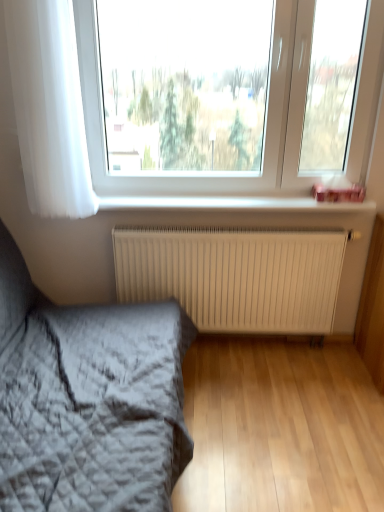
Question: Considering the relative sizes of white matte radiator at center and white plastic window sill at upper center in the image provided, is white matte radiator at center bigger than white plastic window sill at upper center?

Choices:
 (A) no
 (B) yes

Answer: (B)

Question: Considering the relative sizes of white matte radiator at center and white plastic window sill at upper center in the image provided, is white matte radiator at center wider than white plastic window sill at upper center?

Choices:
 (A) yes
 (B) no

Answer: (B)

Question: From the image's perspective, would you say white matte radiator at center is positioned over white plastic window sill at upper center?

Choices:
 (A) no
 (B) yes

Answer: (A)

Question: From the image's perspective, is white matte radiator at center below white plastic window sill at upper center?

Choices:
 (A) no
 (B) yes

Answer: (B)

Question: Considering the relative sizes of white matte radiator at center and white plastic window sill at upper center in the image provided, is white matte radiator at center thinner than white plastic window sill at upper center?

Choices:
 (A) no
 (B) yes

Answer: (B)

Question: Based on their positions, is white plastic window sill at upper center located to the left or right of white plastic window at upper center?

Choices:
 (A) left
 (B) right

Answer: (B)

Question: From the image's perspective, is white plastic window sill at upper center positioned above or below white plastic window at upper center?

Choices:
 (A) below
 (B) above

Answer: (A)

Question: Considering their positions, is white plastic window sill at upper center located in front of or behind white plastic window at upper center?

Choices:
 (A) front
 (B) behind

Answer: (B)

Question: In terms of height, does white plastic window sill at upper center look taller or shorter compared to white plastic window at upper center?

Choices:
 (A) tall
 (B) short

Answer: (B)

Question: Relative to white matte radiator at center, is white sheer curtain at left in front or behind?

Choices:
 (A) behind
 (B) front

Answer: (B)

Question: From a real-world perspective, is white sheer curtain at left physically located above or below white matte radiator at center?

Choices:
 (A) above
 (B) below

Answer: (A)

Question: Visually, is white sheer curtain at left positioned to the left or to the right of white matte radiator at center?

Choices:
 (A) left
 (B) right

Answer: (A)

Question: From the image's perspective, relative to white matte radiator at center, is white sheer curtain at left above or below?

Choices:
 (A) above
 (B) below

Answer: (A)

Question: In the image, is white matte radiator at center positioned in front of or behind white sheer curtain at left?

Choices:
 (A) behind
 (B) front

Answer: (A)

Question: Is white matte radiator at center situated inside white sheer curtain at left or outside?

Choices:
 (A) inside
 (B) outside

Answer: (B)